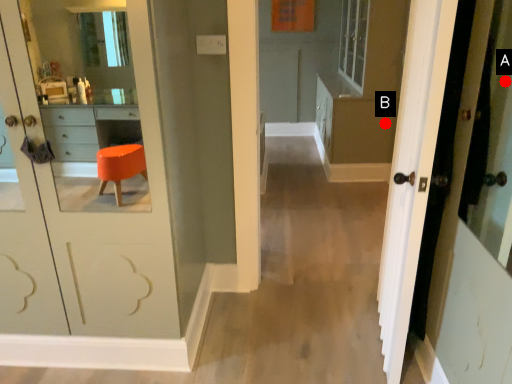
Question: Two points are circled on the image, labeled by A and B beside each circle. Among these points, which one is nearest to the camera?

Choices:
 (A) A is closer
 (B) B is closer

Answer: (A)